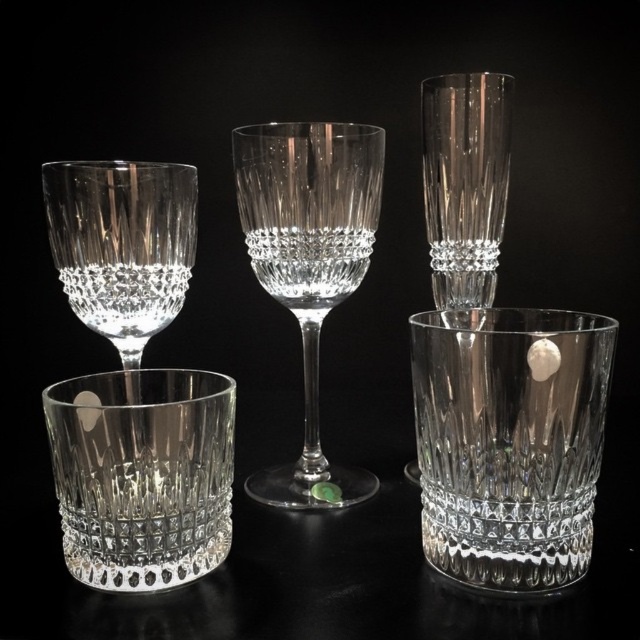
Question: Which of these objects is positioned farthest from the clear crystal shot glass at center?

Choices:
 (A) crystal clear wine glass at center
 (B) clear crystal cup at center
 (C) clear crystal wine glass at center

Answer: (C)

Question: Is clear crystal cup at center below clear crystal wine glass at center?

Choices:
 (A) no
 (B) yes

Answer: (B)

Question: Does clear crystal shot glass at center appear under clear crystal cup at center?

Choices:
 (A) no
 (B) yes

Answer: (A)

Question: Is the position of clear crystal cup at center more distant than that of crystal clear wine glass at center?

Choices:
 (A) no
 (B) yes

Answer: (A)

Question: Estimate the real-world distances between objects in this image. Which object is closer to the clear crystal cup at center?

Choices:
 (A) crystal clear wine glass at center
 (B) clear crystal wine glass at center
 (C) clear crystal shot glass at center

Answer: (B)

Question: Which point is closer to the camera?

Choices:
 (A) coord(522,474)
 (B) coord(104,374)
 (C) coord(131,216)
 (D) coord(358,268)

Answer: (A)